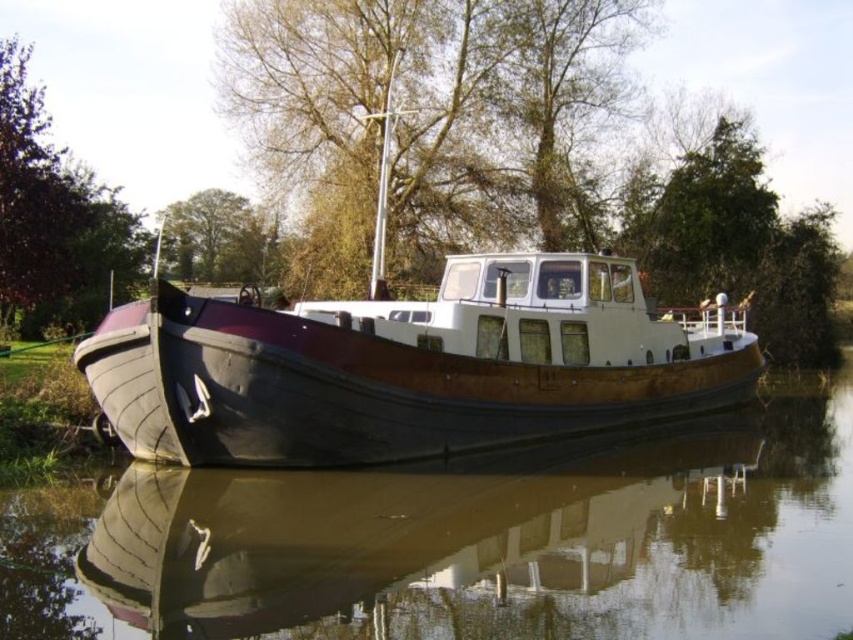
You are an observer looking at the boat scene. You notice two trees at the upper center of the image. Which tree is taller, the brown textured tree at upper center or the green leafy tree at upper center?

The brown textured tree at upper center is taller than the green leafy tree at upper center according to the description.

You are standing on the dock and looking at the brown wooden boat at center and the brown textured tree at upper center. Which object is positioned higher in the image?

The brown textured tree at upper center is positioned higher in the image than the brown wooden boat at center.

Looking at the scene of the boat and trees, which tree is positioned to the right when comparing the brown textured tree at upper center and the green leafy tree at upper center?

The brown textured tree at upper center is positioned to the right of the green leafy tree at upper center.